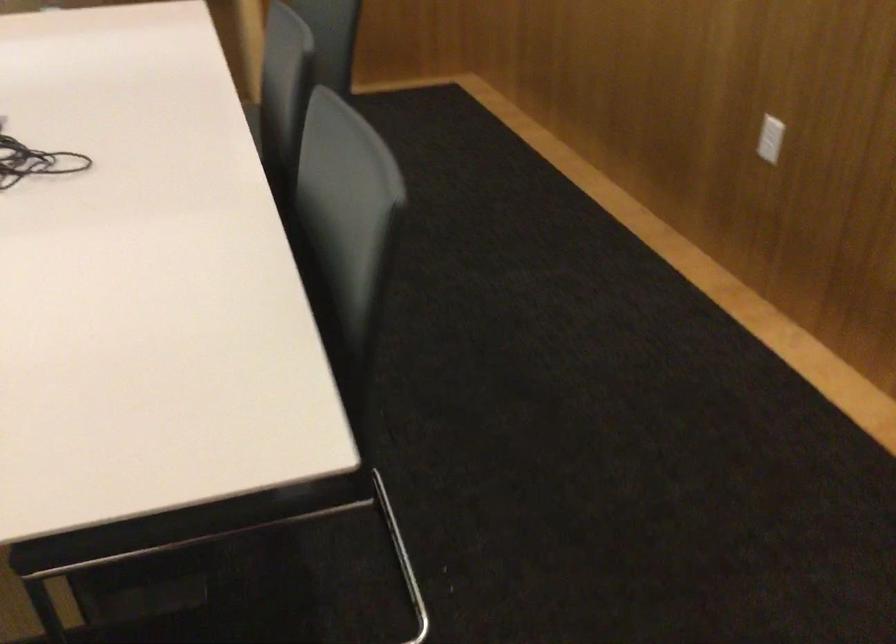
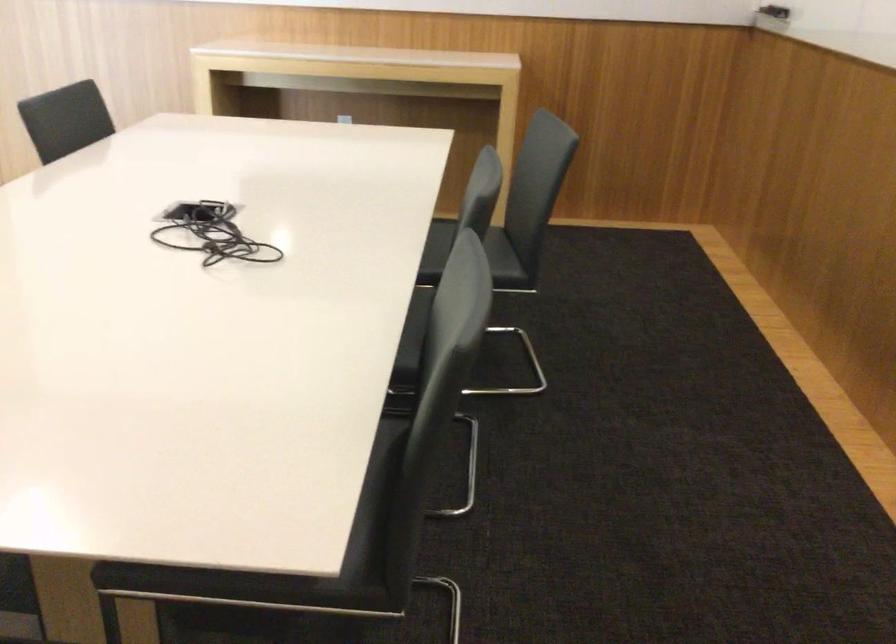
Question: Based on the continuous images, in which direction is the camera rotating? Reply with the corresponding letter.

Choices:
 (A) Left
 (B) Right
 (C) Up
 (D) Down

Answer: (A)